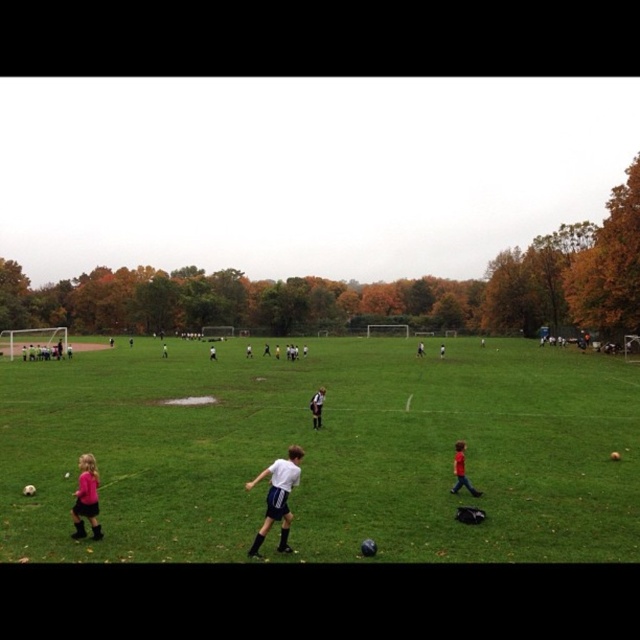
You are a soccer coach observing the field. You notice the green grassy field at center and the white jersey at center. Which object is shorter in height?

The green grassy field at center is shorter in height compared to the white jersey at center.